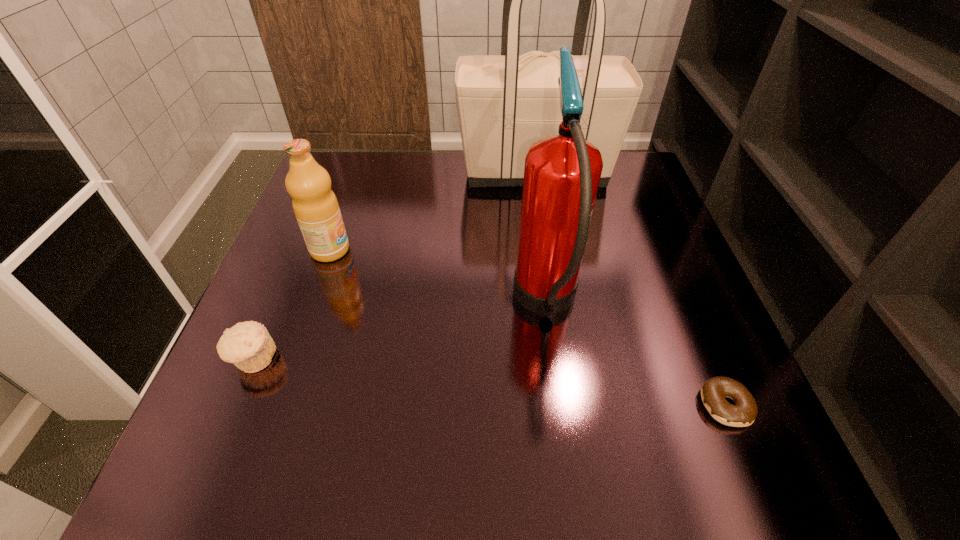
In order to click on shopping bag in this screenshot , I will do `click(505, 103)`.

Where is `fire extinguisher`? The image size is (960, 540). fire extinguisher is located at coordinates (562, 172).

You are a GUI agent. You are given a task and a screenshot of the screen. Output one action in this format:
    pyautogui.click(x=<x>, y=<y>)
    Task: Click on the fruit juice
    The image size is (960, 540).
    Given the screenshot: What is the action you would take?
    pyautogui.click(x=316, y=208)

At what (x,y) coordinates should I click in order to perform the action: click on muffin. Please return your answer as a coordinate pair (x, y). The image size is (960, 540). Looking at the image, I should click on tap(248, 345).

Find the location of a particular element. The height and width of the screenshot is (540, 960). the shortest object is located at coordinates (742, 414).

Where is `doughnut`? Image resolution: width=960 pixels, height=540 pixels. doughnut is located at coordinates (742, 414).

Image resolution: width=960 pixels, height=540 pixels. In order to click on free spot located 0.400m with handles facing forward on the farthest object in this screenshot , I will do `click(317, 172)`.

Image resolution: width=960 pixels, height=540 pixels. In order to click on vacant space situated with handles facing forward on the farthest object in this screenshot , I will do `click(327, 172)`.

At what (x,y) coordinates should I click in order to perform the action: click on free space located with handles facing forward on the farthest object. Please return your answer as a coordinate pair (x, y). The image size is (960, 540). Looking at the image, I should click on (434, 172).

This screenshot has width=960, height=540. In order to click on vacant position located 0.100m on the front of the fire extinguisher in this screenshot , I will do `click(563, 422)`.